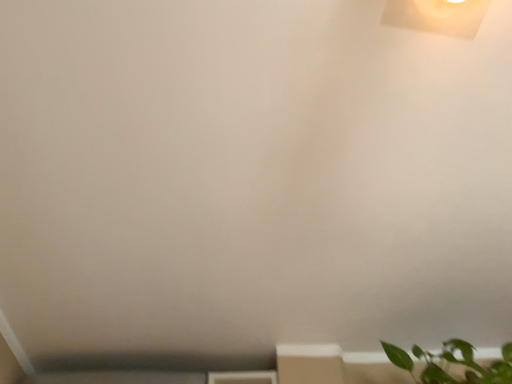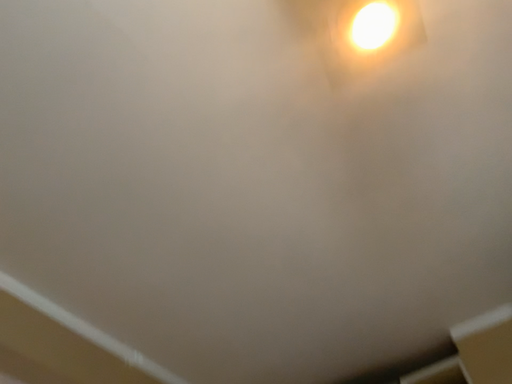
Question: How did the camera likely rotate when shooting the video?

Choices:
 (A) rotated right
 (B) rotated left

Answer: (B)